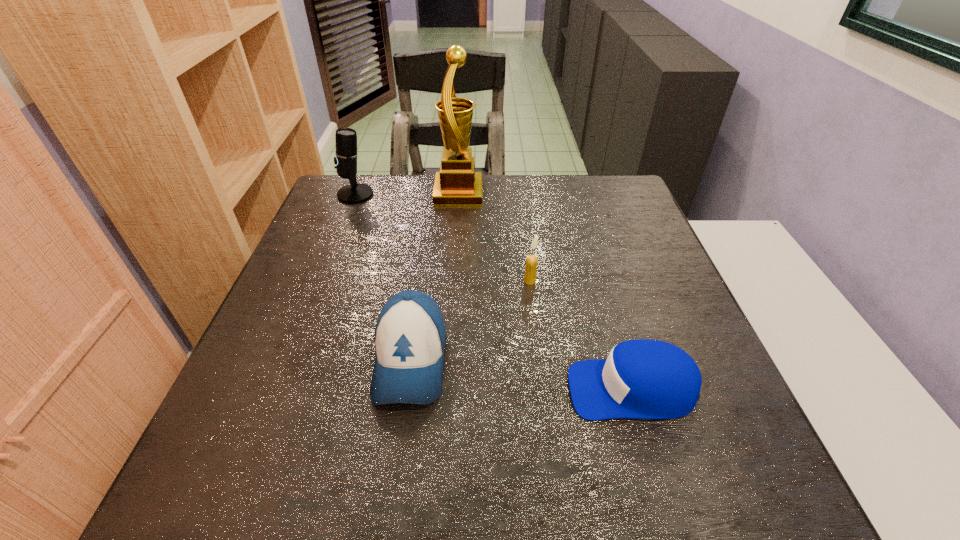
Find the location of a particular element. This screenshot has height=540, width=960. award is located at coordinates (457, 184).

Find the location of a particular element. The image size is (960, 540). the leftmost object is located at coordinates (346, 153).

Where is `the fourth shortest object`? The image size is (960, 540). the fourth shortest object is located at coordinates (346, 153).

Locate an element on the screen. The width and height of the screenshot is (960, 540). candle is located at coordinates (531, 261).

Find the location of a particular element. The image size is (960, 540). the fourth object from left to right is located at coordinates (531, 261).

The image size is (960, 540). I want to click on the taller baseball cap, so click(x=410, y=335).

In order to click on the shorter baseball cap in this screenshot , I will do `click(643, 378)`.

This screenshot has width=960, height=540. Identify the location of the rightmost object. (643, 378).

What are the coordinates of `vacant space located 0.210m on the front-facing side of the tallest object` in the screenshot? It's located at (553, 193).

You are a GUI agent. You are given a task and a screenshot of the screen. Output one action in this format:
    pyautogui.click(x=<x>, y=<y>)
    Task: Click on the blank area located on the right of the leftmost object
    The height and width of the screenshot is (540, 960).
    Given the screenshot: What is the action you would take?
    pyautogui.click(x=420, y=194)